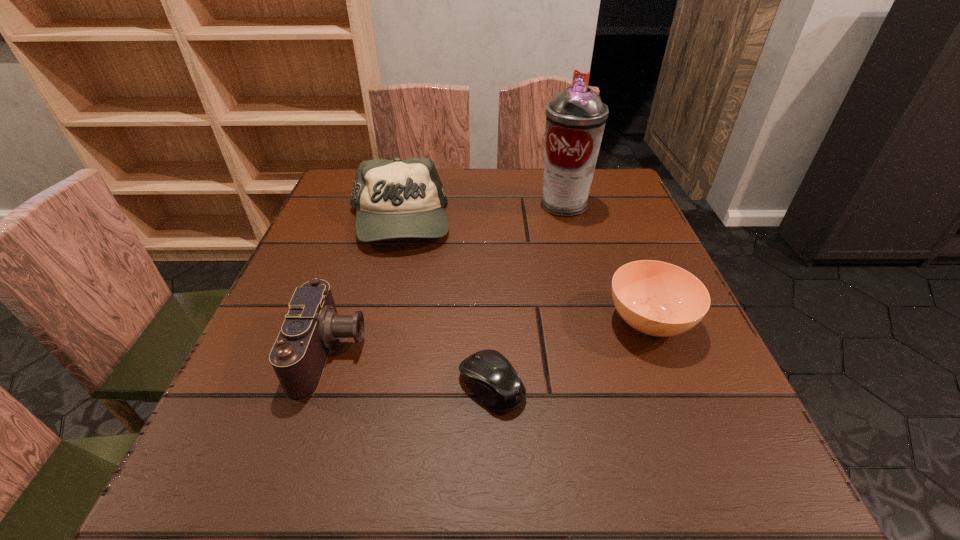
The width and height of the screenshot is (960, 540). I want to click on free region at the left edge of the desktop, so click(x=330, y=217).

Where is `free space at the right edge`? This screenshot has height=540, width=960. free space at the right edge is located at coordinates (579, 219).

Locate an element on the screen. vacant space at the far right corner is located at coordinates (619, 172).

Locate an element on the screen. Image resolution: width=960 pixels, height=540 pixels. vacant space at the near right corner is located at coordinates (673, 463).

Identify the location of vacant space in between the mouse and the tallest object. (528, 295).

Locate an element on the screen. This screenshot has width=960, height=540. unoccupied position between the aerosol can and the shortest object is located at coordinates (528, 295).

This screenshot has width=960, height=540. In order to click on free space between the tallest object and the third tallest object in this screenshot , I will do `click(447, 278)`.

The height and width of the screenshot is (540, 960). Identify the location of free space between the camera and the second shortest object. (490, 337).

Identify the location of vacant space that is in between the tallest object and the third tallest object. (447, 278).

At what (x,y) coordinates should I click in order to perform the action: click on free space between the soup bowl and the third shortest object. Please return your answer as a coordinate pair (x, y). The height and width of the screenshot is (540, 960). Looking at the image, I should click on (490, 337).